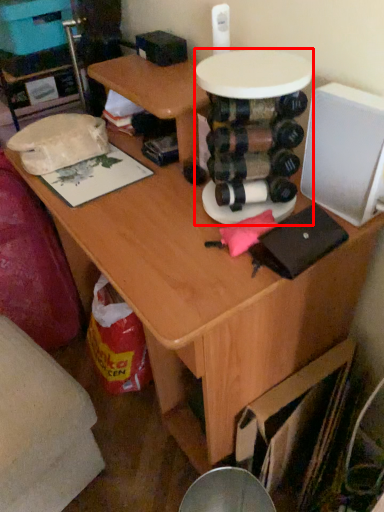
Question: From the image's perspective, what is the correct spatial positioning of round table (annotated by the red box) in reference to swivel chair?

Choices:
 (A) above
 (B) below

Answer: (A)